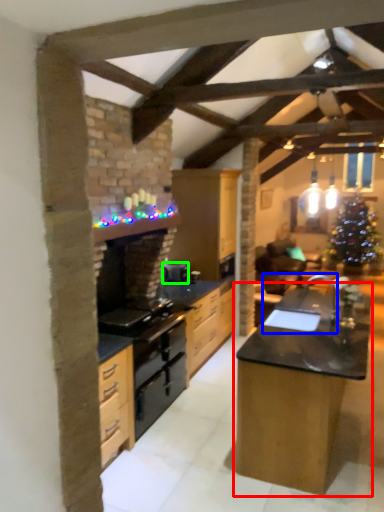
Question: Estimate the real-world distances between objects in this image. Which object is farther from table (highlighted by a red box), sink (highlighted by a blue box) or appliance (highlighted by a green box)?

Choices:
 (A) sink
 (B) appliance

Answer: (B)